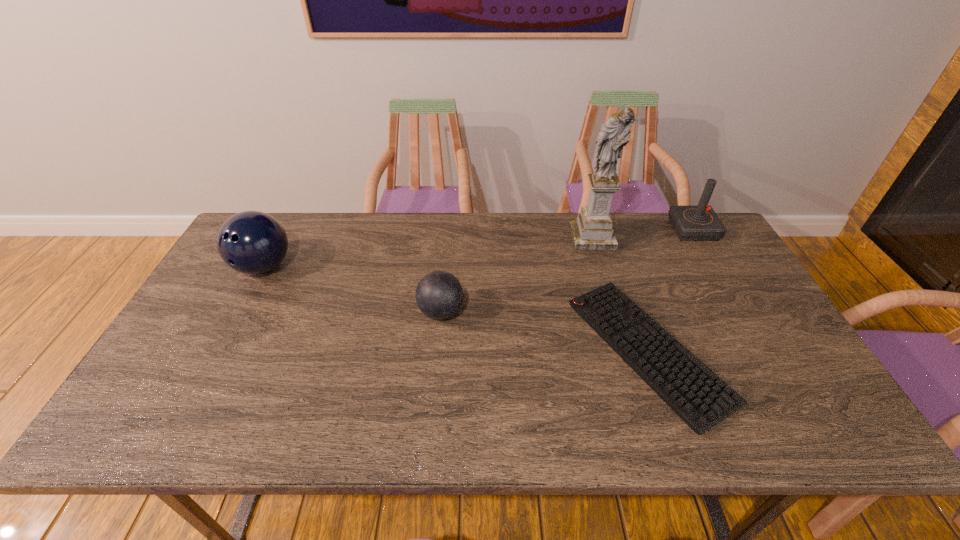
The image size is (960, 540). Find the location of `the tallest object`. the tallest object is located at coordinates (593, 230).

At what (x,y) coordinates should I click in order to perform the action: click on joystick. Please return your answer as a coordinate pair (x, y). The height and width of the screenshot is (540, 960). Looking at the image, I should click on (691, 223).

Where is `the farther bowling ball`? This screenshot has width=960, height=540. the farther bowling ball is located at coordinates (252, 242).

Locate an element on the screen. The width and height of the screenshot is (960, 540). the left bowling ball is located at coordinates (252, 242).

Locate an element on the screen. The image size is (960, 540). the fourth object from right to left is located at coordinates (439, 295).

The image size is (960, 540). Identify the location of the fourth tallest object. (439, 295).

The image size is (960, 540). In order to click on computer keyboard in this screenshot , I will do `click(693, 391)`.

At what (x,y) coordinates should I click in order to perform the action: click on free region located on the front-facing side of the sculpture. Please return your answer as a coordinate pair (x, y). The image size is (960, 540). Looking at the image, I should click on (610, 298).

Locate an element on the screen. The height and width of the screenshot is (540, 960). free space located on the rectangular base of the joystick is located at coordinates (568, 230).

The image size is (960, 540). In order to click on vacant space located on the rectangular base of the joystick in this screenshot , I will do `click(625, 230)`.